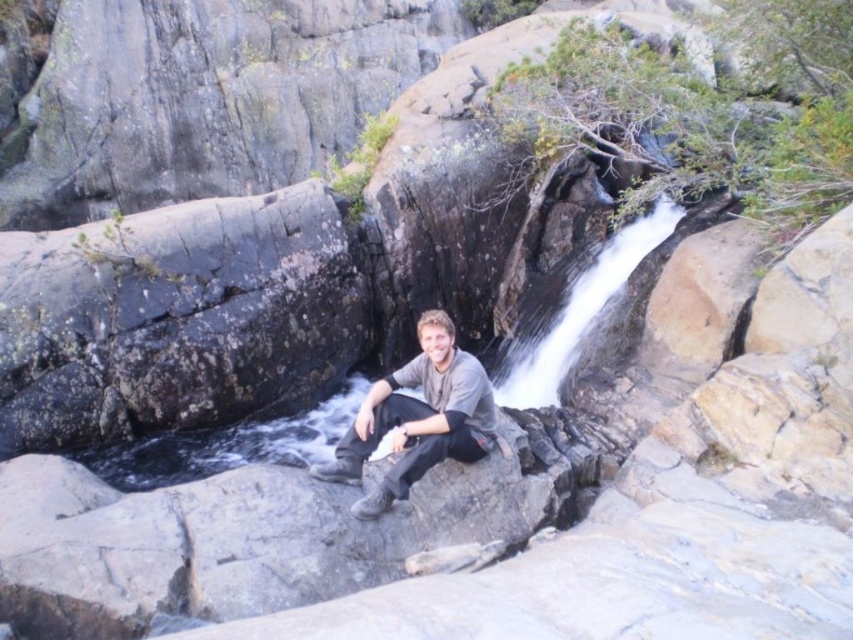
Question: Is smooth rock creek at center bigger than gray matte shirt at center?

Choices:
 (A) yes
 (B) no

Answer: (A)

Question: Does smooth rock creek at center come behind gray matte shirt at center?

Choices:
 (A) no
 (B) yes

Answer: (B)

Question: Which of the following is the farthest from the observer?

Choices:
 (A) (433, 452)
 (B) (627, 252)

Answer: (B)

Question: Which object appears farthest from the camera in this image?

Choices:
 (A) gray matte shirt at center
 (B) smooth rock creek at center

Answer: (B)

Question: Is smooth rock creek at center smaller than gray matte shirt at center?

Choices:
 (A) yes
 (B) no

Answer: (B)